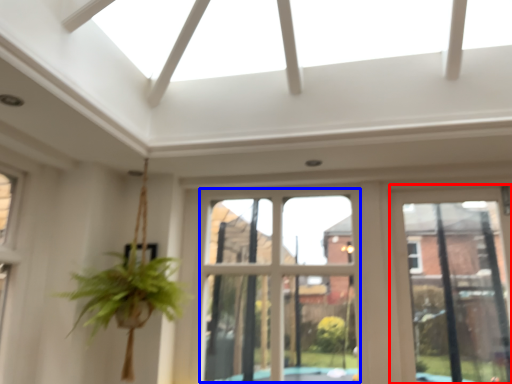
Question: Which of the following is the closest to the observer, window frame (highlighted by a red box) or bay window (highlighted by a blue box)?

Choices:
 (A) window frame
 (B) bay window

Answer: (B)